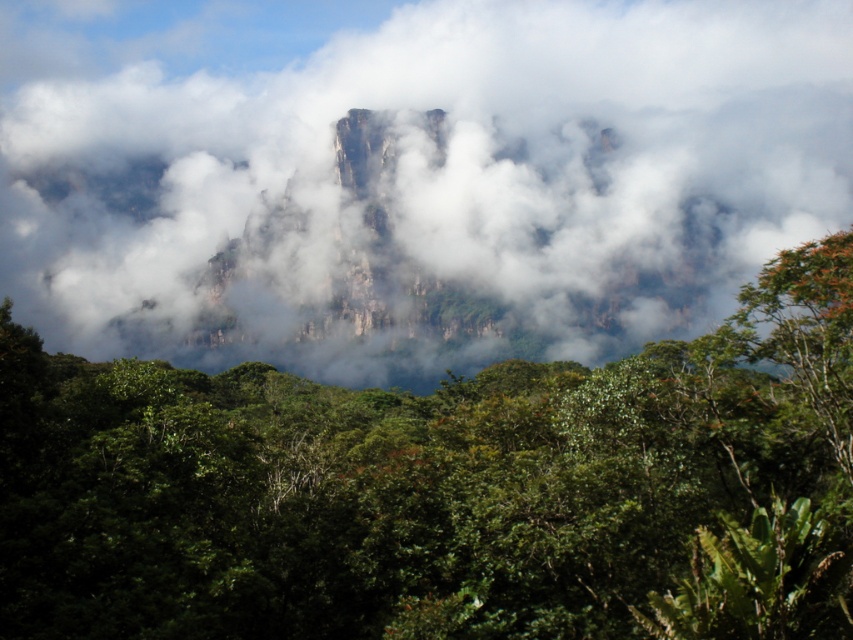
Based on the scene description, which object is positioned higher in the image? The white fluffy cloud at center or the green leafy tree at upper center?

The white fluffy cloud at center is positioned higher than the green leafy tree at upper center.

You are an airplane passenger looking out the window. You see the white fluffy cloud at center and the green leafy tree at upper center. Which one is closer to the airplane?

The white fluffy cloud at center is closer to the airplane because it is positioned to the left of the green leafy tree at upper center, which is further away.

You are an observer looking at the mountain landscape. You notice a white fluffy cloud at center and a green leafy tree at upper center. Which object is closer to you?

The white fluffy cloud at center is closer to you than the green leafy tree at upper center because it is further to the viewer.